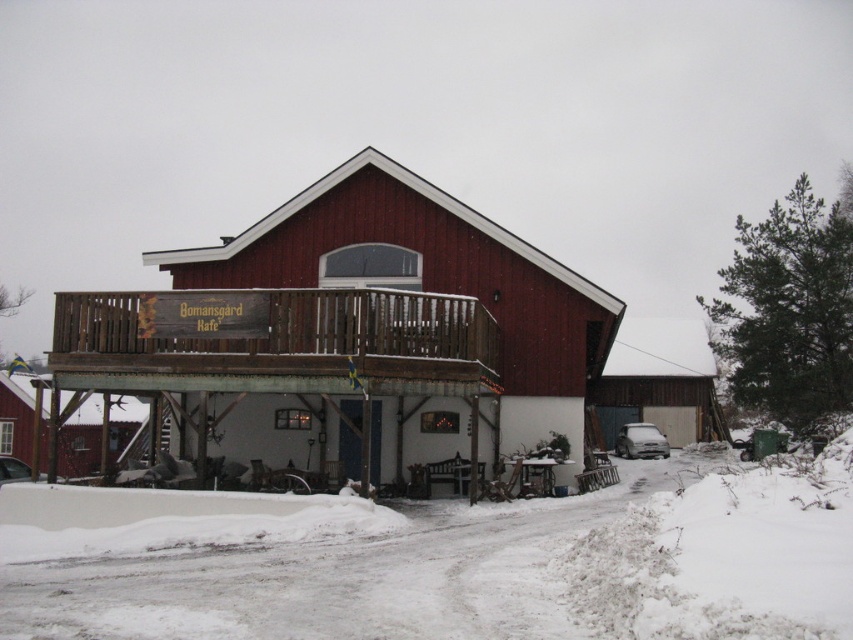
Question: Among these points, which one is farthest from the camera?

Choices:
 (A) (404, 625)
 (B) (352, 337)

Answer: (B)

Question: Is matte red barn at center wider than white powdery snow at lower center?

Choices:
 (A) yes
 (B) no

Answer: (B)

Question: Among these points, which one is farthest from the camera?

Choices:
 (A) (24, 636)
 (B) (403, 225)

Answer: (B)

Question: Is matte red barn at center further to the viewer compared to white powdery snow at lower center?

Choices:
 (A) no
 (B) yes

Answer: (B)

Question: Can you confirm if matte red barn at center is bigger than white powdery snow at lower center?

Choices:
 (A) no
 (B) yes

Answer: (B)

Question: Which of the following is the closest to the observer?

Choices:
 (A) (318, 330)
 (B) (19, 570)

Answer: (B)